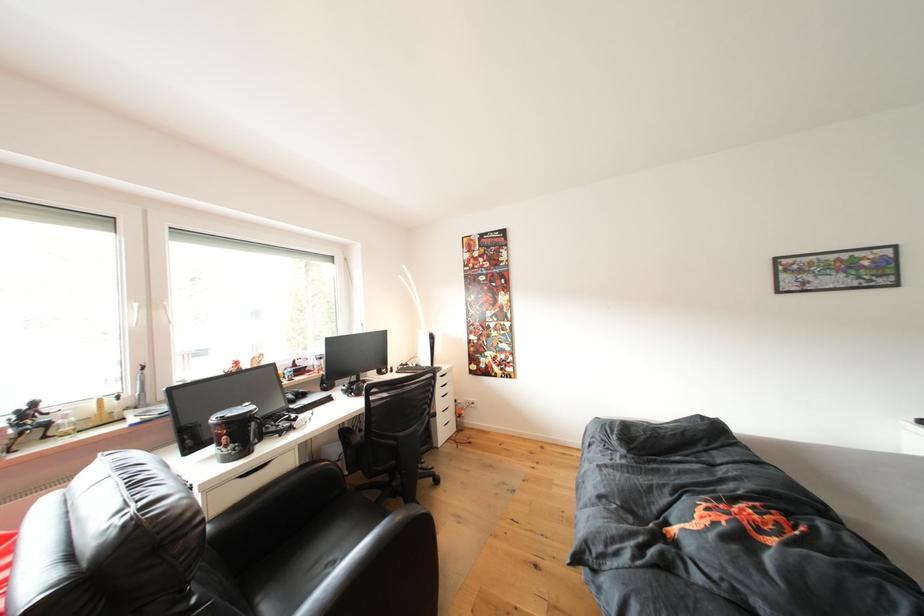
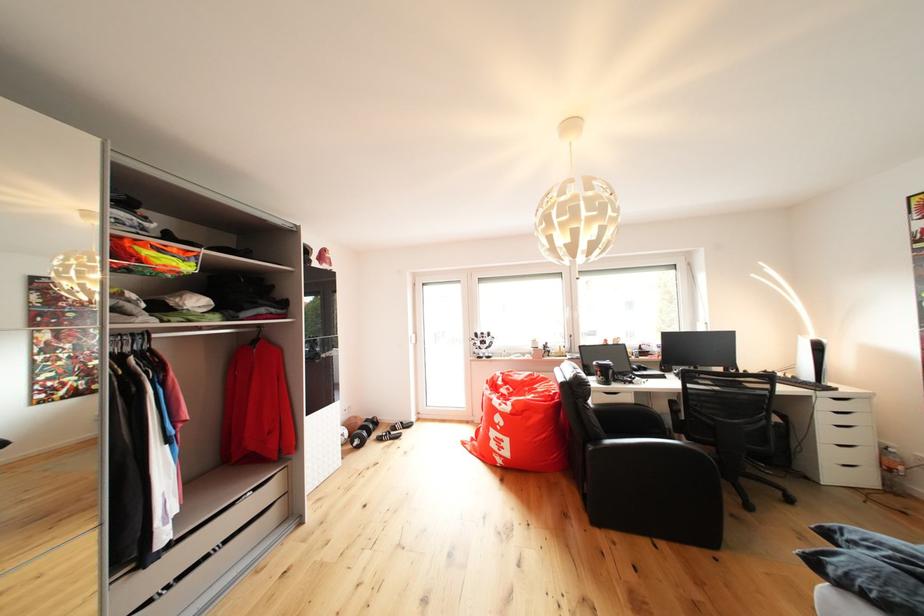
In the second image, find the point that corresponds to the point at 313,450 in the first image.

(647, 399)